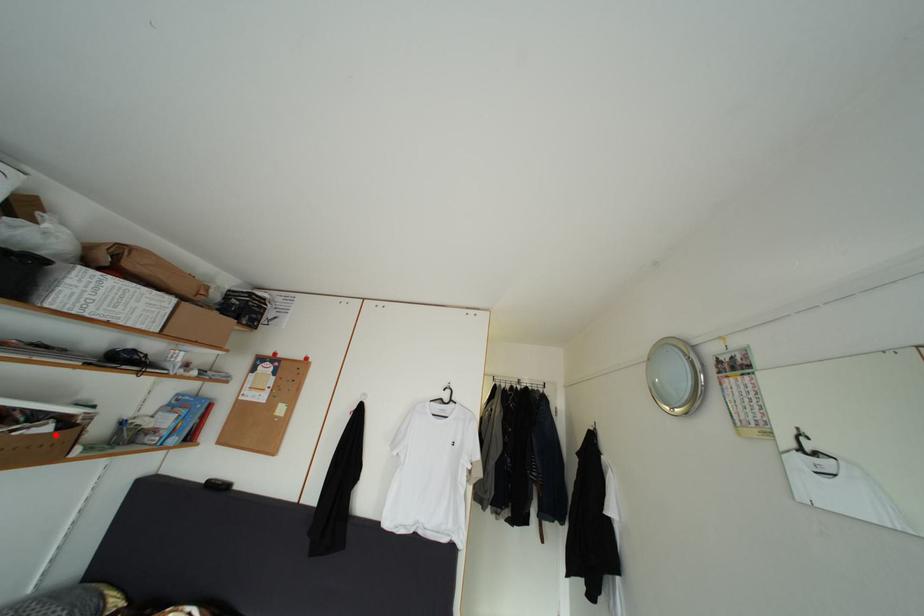
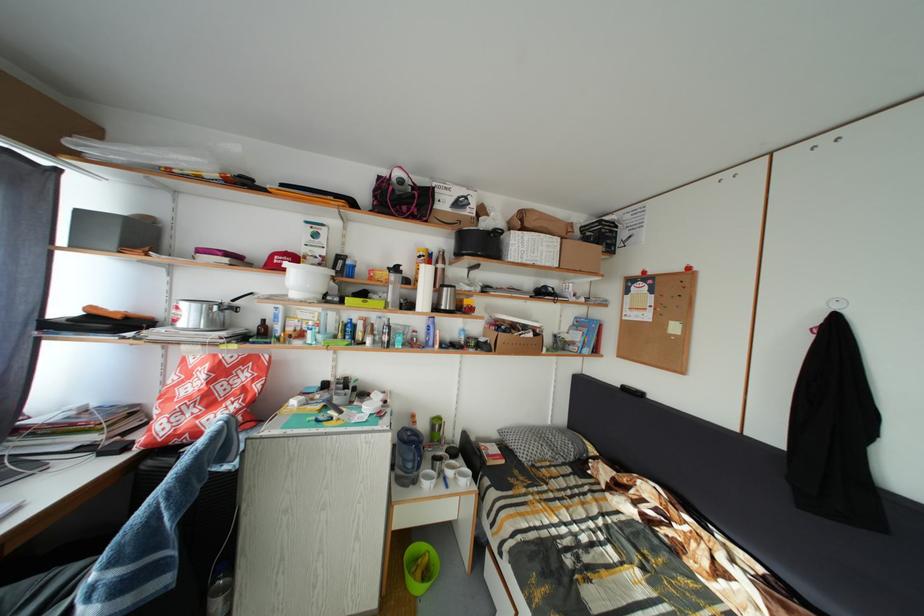
Question: I am providing you with two images of the same scene from different viewpoints. A red point is marked on the first image. Can you still see the location of the red point in image 2?

Choices:
 (A) Yes
 (B) No

Answer: (A)